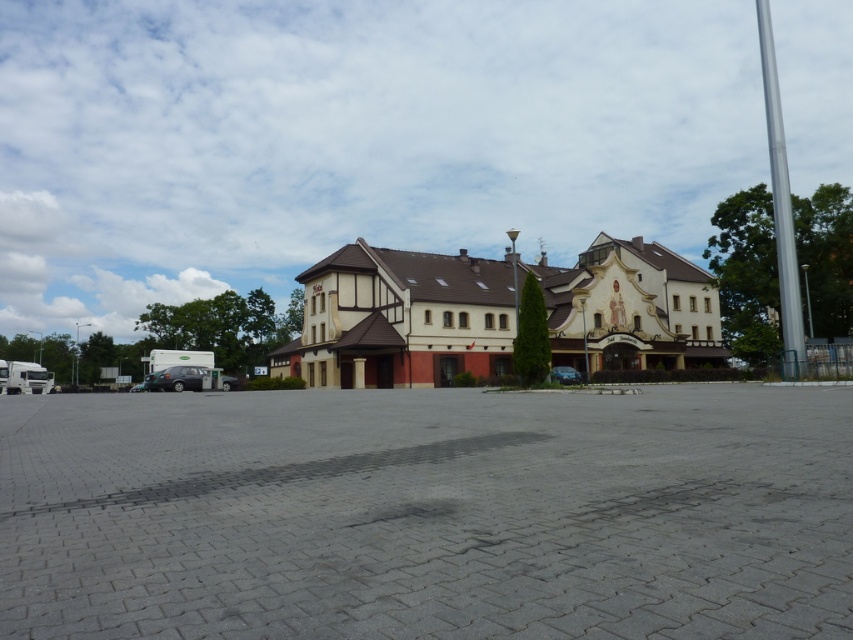
You are a delivery person trying to park your 1.8 meters tall delivery cart between the matte black car at lower left and the shiny black sedan at center. Can your cart fit vertically between them?

The matte black car at lower left has a greater height compared to shiny black sedan at center. Since the height difference is not specified, but the cart is 1.8 meters tall, it is uncertain if there is enough vertical space between them to park the cart.

You are standing at the entrance of the building and want to walk to the point marked as point (428,515). Is the path clear? Please explain.

The point (428,515) is located on the gray concrete parking lot at center. Since the parking lot is paved and the scene mentions vehicles parked near the building but does not mention any obstacles at the center, the path should be clear for walking.

You are a delivery person trying to park your van in the gray concrete parking lot at center. There is a matte black car at lower left already parked there. Based on the scene, can you drive your van directly into the parking lot without moving the car?

The gray concrete parking lot at center is above the matte black car at lower left, which means the car is parked on the same level as the parking lot. Since the parking lot is a flat paved area, you can drive your van directly into the parking lot without needing to move the matte black car at lower left, as they are on the same level.